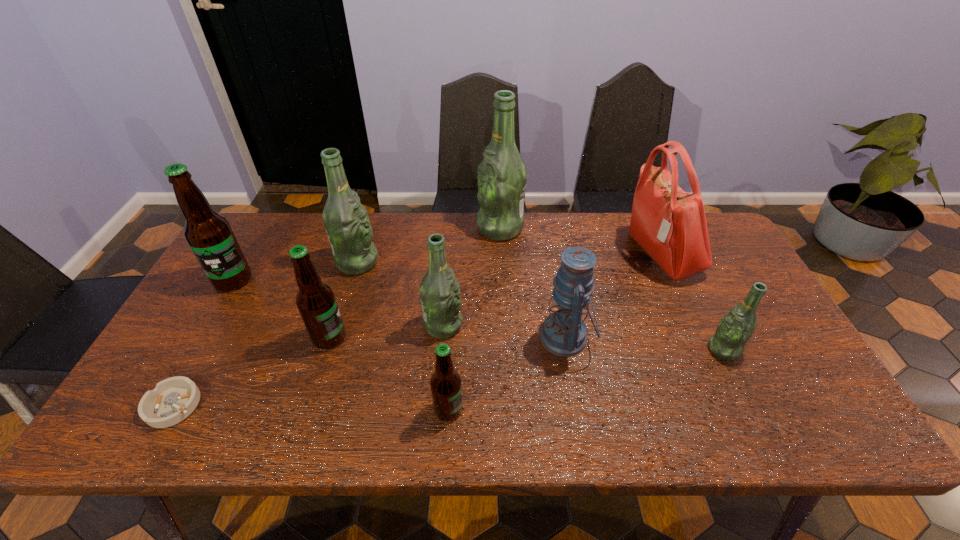
In order to click on the fourth object from right to left in this screenshot , I will do `click(502, 175)`.

The height and width of the screenshot is (540, 960). What are the coordinates of `the second green beer bottle from right to left` in the screenshot? It's located at (502, 175).

Locate an element on the screen. The width and height of the screenshot is (960, 540). red handbag is located at coordinates (670, 224).

Image resolution: width=960 pixels, height=540 pixels. Find the location of `the leftmost green beer bottle`. the leftmost green beer bottle is located at coordinates (346, 221).

At what (x,y) coordinates should I click in order to perform the action: click on the third smallest green beer bottle. Please return your answer as a coordinate pair (x, y). The image size is (960, 540). Looking at the image, I should click on (346, 221).

Find the location of a particular element. This screenshot has width=960, height=540. the farthest brown beer bottle is located at coordinates (209, 235).

Find the location of a particular element. the biggest brown beer bottle is located at coordinates (209, 235).

Identify the location of the second smallest green beer bottle. Image resolution: width=960 pixels, height=540 pixels. (439, 291).

In order to click on the second smallest brown beer bottle in this screenshot , I will do `click(316, 302)`.

Locate an element on the screen. the second nearest brown beer bottle is located at coordinates (316, 302).